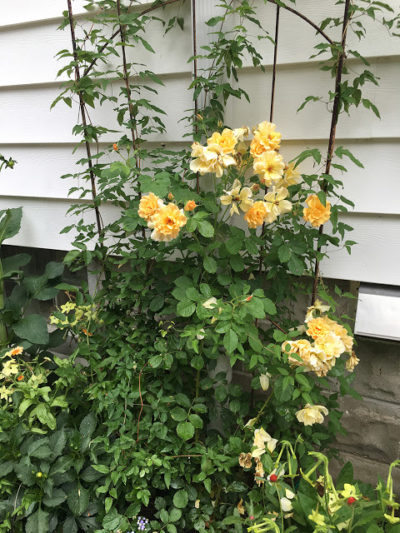
Locate an element on the screen. This screenshot has width=400, height=533. wall is located at coordinates (373, 407).